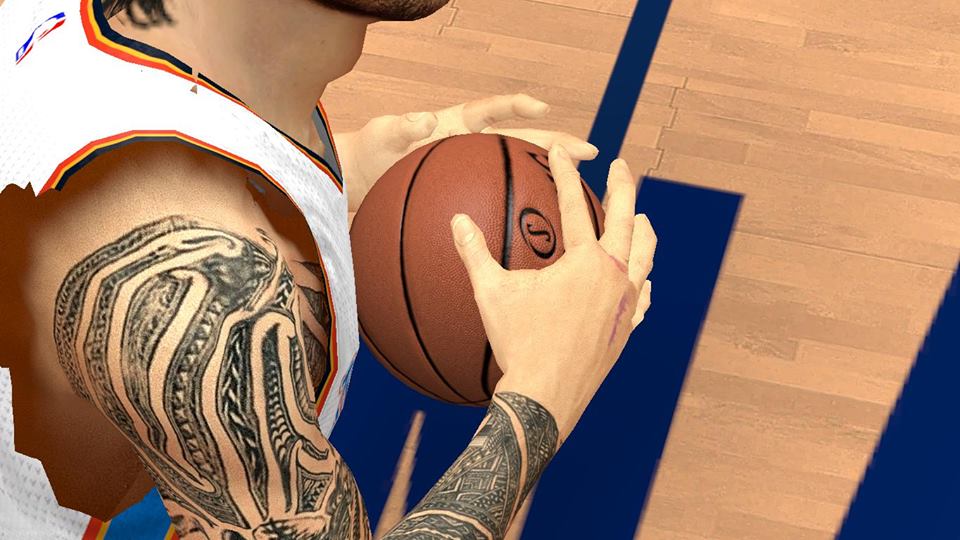
Identify the location of floor. (851, 216).